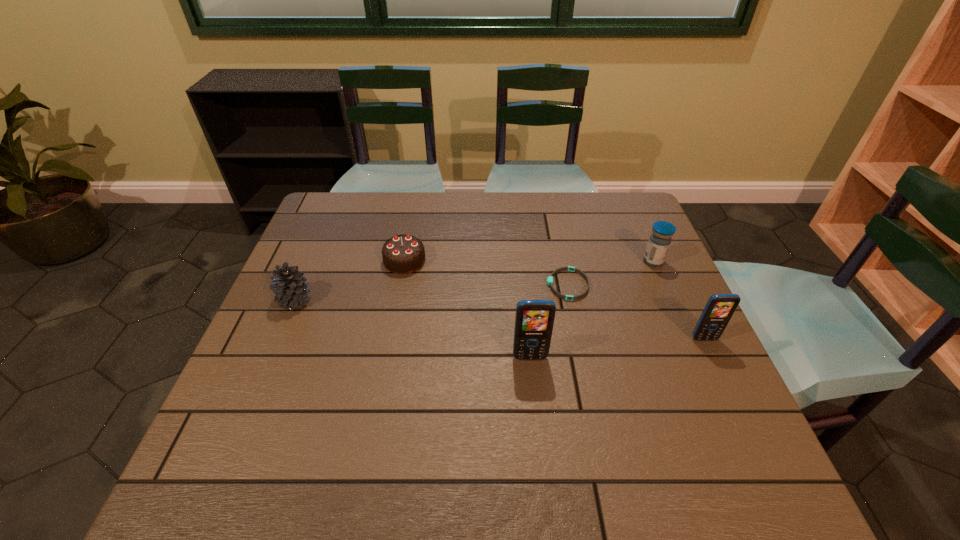
Where is `empty location between the shorter cellular telephone and the wristband`? The image size is (960, 540). empty location between the shorter cellular telephone and the wristband is located at coordinates (636, 312).

This screenshot has height=540, width=960. I want to click on blank region between the second object from left to right and the right cellular telephone, so click(554, 300).

This screenshot has width=960, height=540. I want to click on unoccupied area between the medicine and the shorter cellular telephone, so click(679, 300).

You are a GUI agent. You are given a task and a screenshot of the screen. Output one action in this format:
    pyautogui.click(x=<x>, y=<y>)
    Task: Click on the free space between the second object from left to right and the medicine
    This screenshot has height=540, width=960.
    Given the screenshot: What is the action you would take?
    pyautogui.click(x=529, y=261)

Identify the location of empty space between the leftmost object and the third object from left to right. This screenshot has width=960, height=540. (413, 329).

Where is `object that can be found as the third closest to the wristband`? The height and width of the screenshot is (540, 960). object that can be found as the third closest to the wristband is located at coordinates (719, 309).

Identify which object is located as the third nearest to the left cellular telephone. Please provide its 2D coordinates. Your answer should be formatted as a tuple, i.e. [(x, y)], where the tuple contains the x and y coordinates of a point satisfying the conditions above.

[(402, 254)]

This screenshot has height=540, width=960. Identify the location of free point that satisfies the following two spatial constraints: 1. on the buckle of the wristband; 2. on the screen of the third object from left to right. (583, 357).